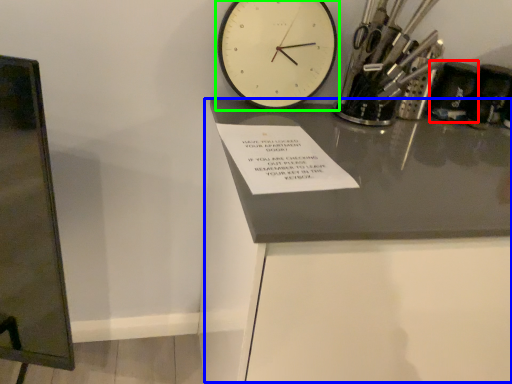
Question: Which object is positioned farthest from stationery (highlighted by a red box)? Select from table (highlighted by a blue box) and wall clock (highlighted by a green box).

Choices:
 (A) table
 (B) wall clock

Answer: (A)